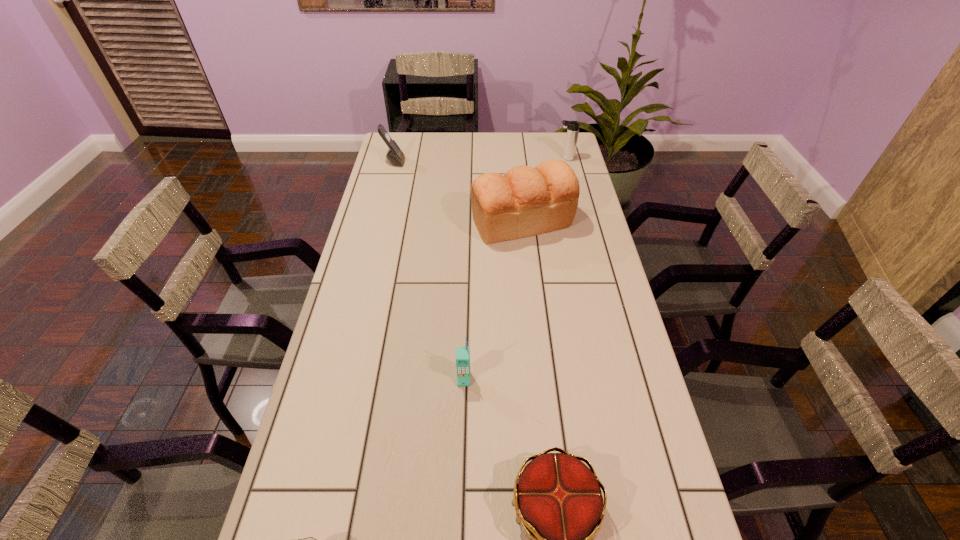
Where is `free space that satisfies the following two spatial constraints: 1. on the front-facing side of the bread; 2. on the right side of the left cellular telephone`? free space that satisfies the following two spatial constraints: 1. on the front-facing side of the bread; 2. on the right side of the left cellular telephone is located at coordinates (379, 222).